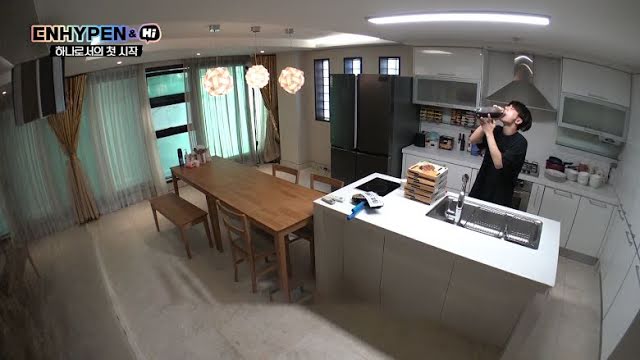
Find the location of a particular element. Image resolution: width=640 pixels, height=360 pixels. bench is located at coordinates (182, 218).